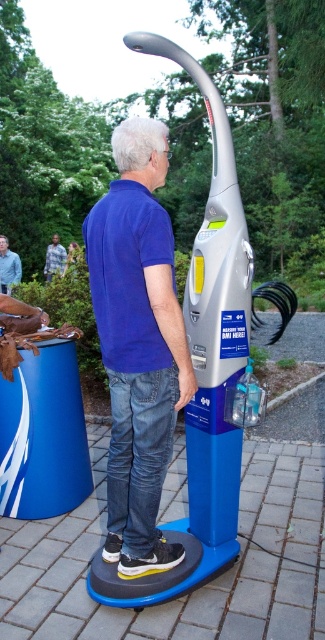
You are a fashion designer observing two shirts in an image. The blue shirt at upper center and the green textured shirt at center. Which shirt takes up more space in the image?

The green textured shirt at center occupies more space than the blue shirt at upper center.